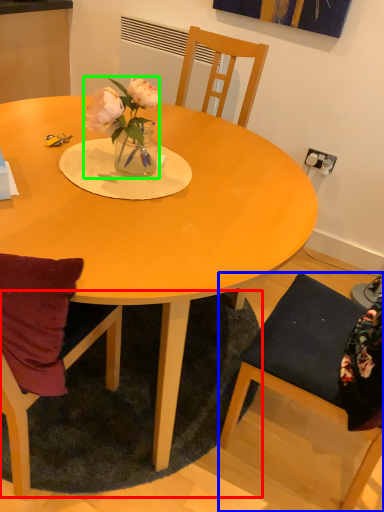
Question: Based on their relative distances, which object is farther from mat (highlighted by a red box)? Choose from chair (highlighted by a blue box) and houseplant (highlighted by a green box).

Choices:
 (A) chair
 (B) houseplant

Answer: (B)